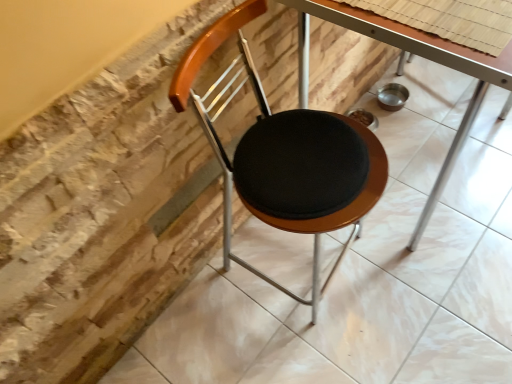
Where is `vacant space in metallic silver table at center (from a real-world perspective)`? This screenshot has width=512, height=384. vacant space in metallic silver table at center (from a real-world perspective) is located at coordinates (420, 152).